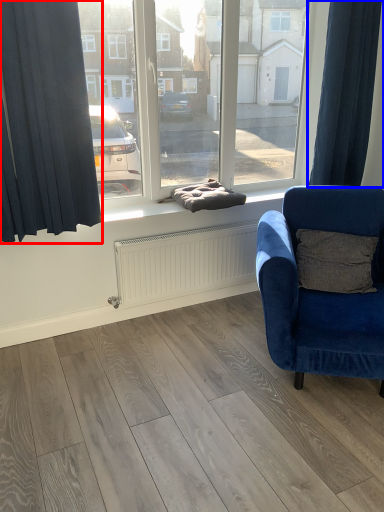
Question: Which object is closer to the camera taking this photo, curtain (highlighted by a red box) or curtain (highlighted by a blue box)?

Choices:
 (A) curtain
 (B) curtain

Answer: (A)